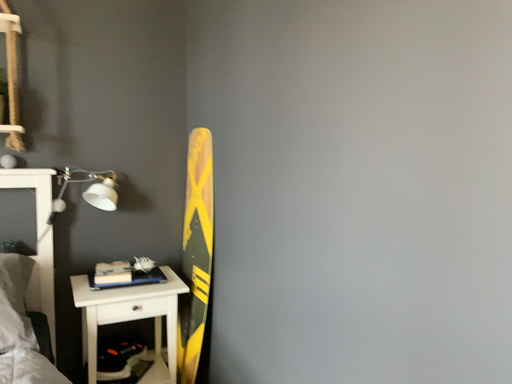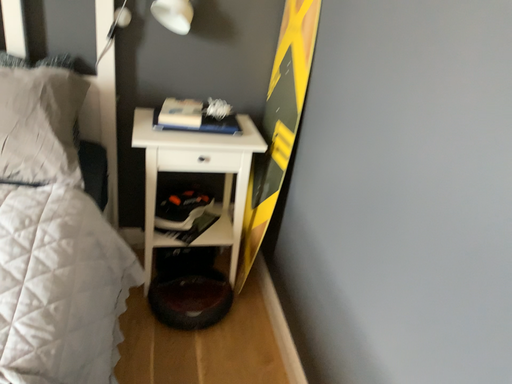
Question: How did the camera likely rotate when shooting the video?

Choices:
 (A) rotated upward
 (B) rotated downward

Answer: (B)